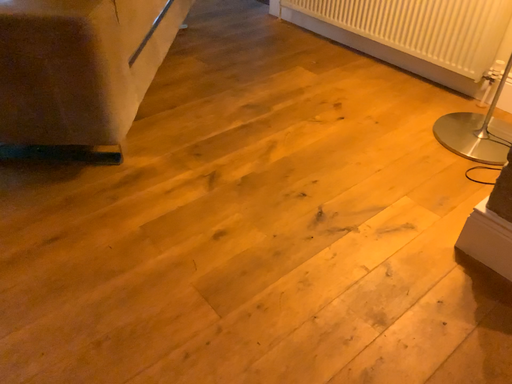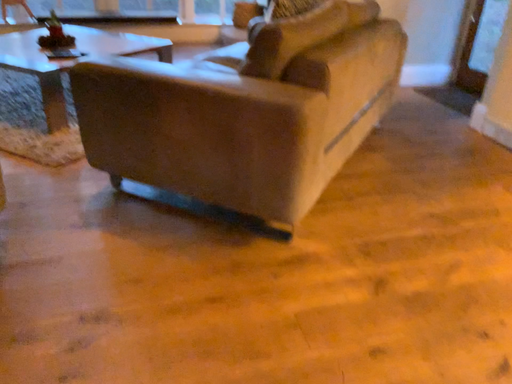
Question: Which way did the camera rotate in the video?

Choices:
 (A) rotated right
 (B) rotated left

Answer: (B)